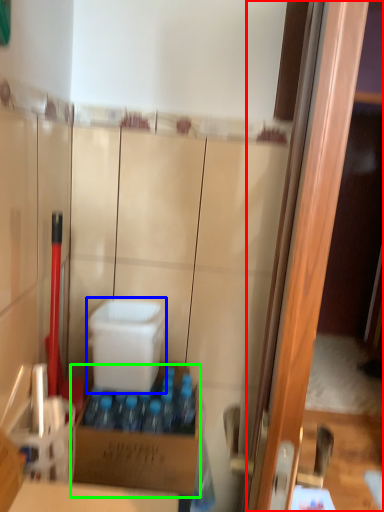
Question: Considering the real-world distances, which object is closest to screen door (highlighted by a red box)? box (highlighted by a blue box) or box (highlighted by a green box).

Choices:
 (A) box
 (B) box

Answer: (B)